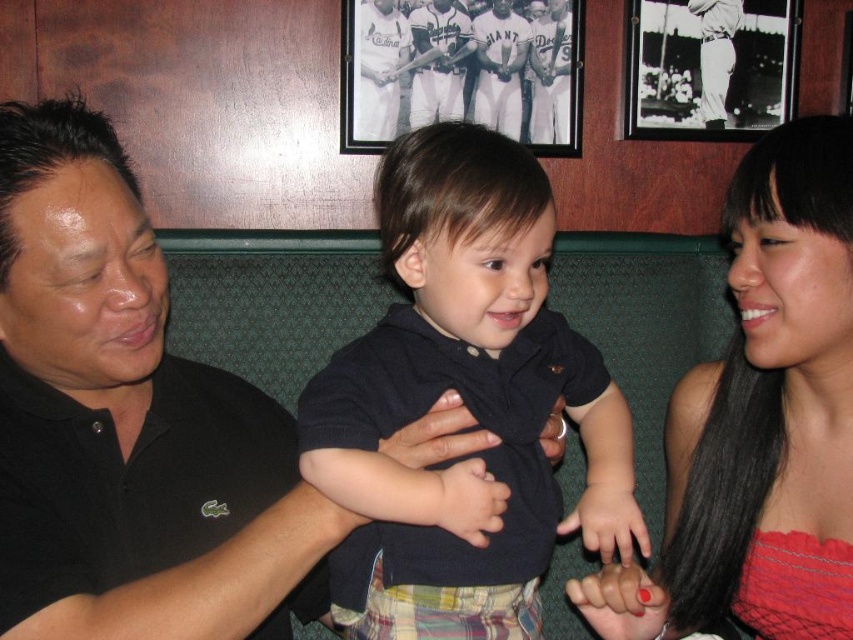
You are a photographer trying to capture a candid shot of the dark blue cotton shirt at center and the matte black dress at center. Since you want to ensure both subjects are fully visible in the frame, which one should you position closer to the camera to avoid cropping?

The dark blue cotton shirt at center is not as tall as the matte black dress at center, so positioning the dark blue cotton shirt at center closer to the camera would help ensure both are fully visible without cropping.

You are an interior designer working on a layout for a sports bar. You need to place a new menu board at a specific coordinate. The menu board must not overlap with the black matte picture frame at upper center. What coordinate should you choose for the menu board?

The black matte picture frame at upper center is located at point (709, 67). To avoid overlapping, the menu board should be placed at a different coordinate such as (426, 320).

Based on the photo, you are a photographer trying to capture a candid shot of the dark blue cotton shirt at center and the matte black dress at center. The camera you are using has a minimum focus distance of 20 centimeters. Can you take a clear photo of both subjects without moving them?

The dark blue cotton shirt at center is 21.83 centimeters from the matte black dress at center. Since the camera requires a minimum focus distance of 20 centimeters, the 21.83 cm distance exceeds this threshold, so the camera can focus on both subjects and take a clear photo.